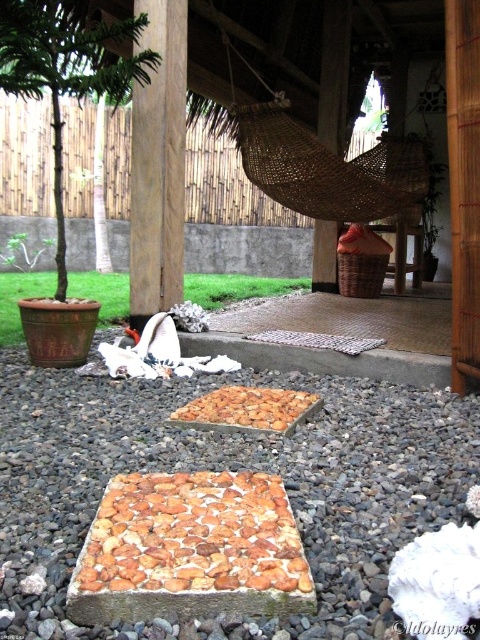
Looking at this image, is woven brown hammock at upper center smaller than brown wood post at center?

No.

Can you confirm if woven brown hammock at upper center is positioned to the left of brown wood post at center?

In fact, woven brown hammock at upper center is to the right of brown wood post at center.

Which is in front, point (393, 188) or point (180, 236)?

Point (180, 236) is more forward.

Locate an element on the screen. Image resolution: width=480 pixels, height=640 pixels. woven brown hammock at upper center is located at coordinates (314, 161).

Is point (249, 490) positioned in front of point (327, 164)?

Yes.

Is point (96, 573) positioned before point (334, 172)?

Yes.

Where is `brown crumbly bread at center`? brown crumbly bread at center is located at coordinates (193, 536).

Does brown crumbly bread at center have a larger size compared to brown wood post at center?

No, brown crumbly bread at center is not bigger than brown wood post at center.

Can you confirm if brown crumbly bread at center is positioned above brown wood post at center?

No, brown crumbly bread at center is not above brown wood post at center.

Which is behind, point (171, 538) or point (180, 300)?

Point (180, 300)

Locate an element on the screen. brown crumbly bread at center is located at coordinates (193, 536).